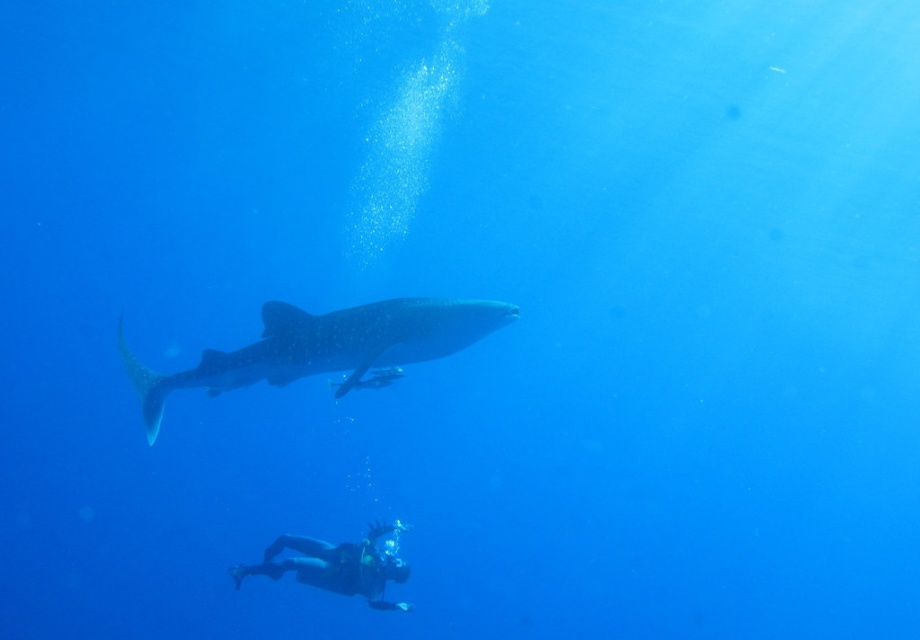
Question: Among these points, which one is nearest to the camera?

Choices:
 (A) (263, 358)
 (B) (381, 561)

Answer: (A)

Question: Can you confirm if speckled skin whale shark at center is wider than black scuba diver at lower center?

Choices:
 (A) yes
 (B) no

Answer: (A)

Question: Does speckled skin whale shark at center have a smaller size compared to black scuba diver at lower center?

Choices:
 (A) yes
 (B) no

Answer: (B)

Question: Which point is farther to the camera?

Choices:
 (A) (315, 547)
 (B) (444, 326)

Answer: (A)

Question: Is speckled skin whale shark at center below black scuba diver at lower center?

Choices:
 (A) yes
 (B) no

Answer: (B)

Question: Which object appears closest to the camera in this image?

Choices:
 (A) speckled skin whale shark at center
 (B) black scuba diver at lower center

Answer: (A)